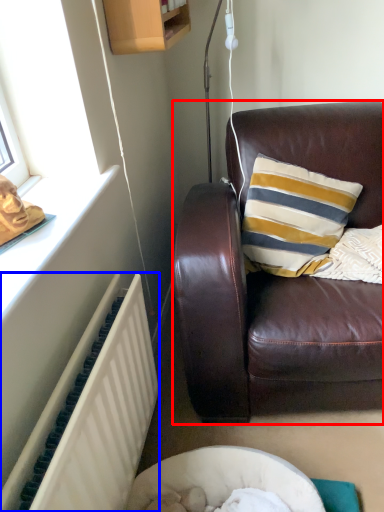
Question: Which object is closer to the camera taking this photo, studio couch (highlighted by a red box) or radiator (highlighted by a blue box)?

Choices:
 (A) studio couch
 (B) radiator

Answer: (B)